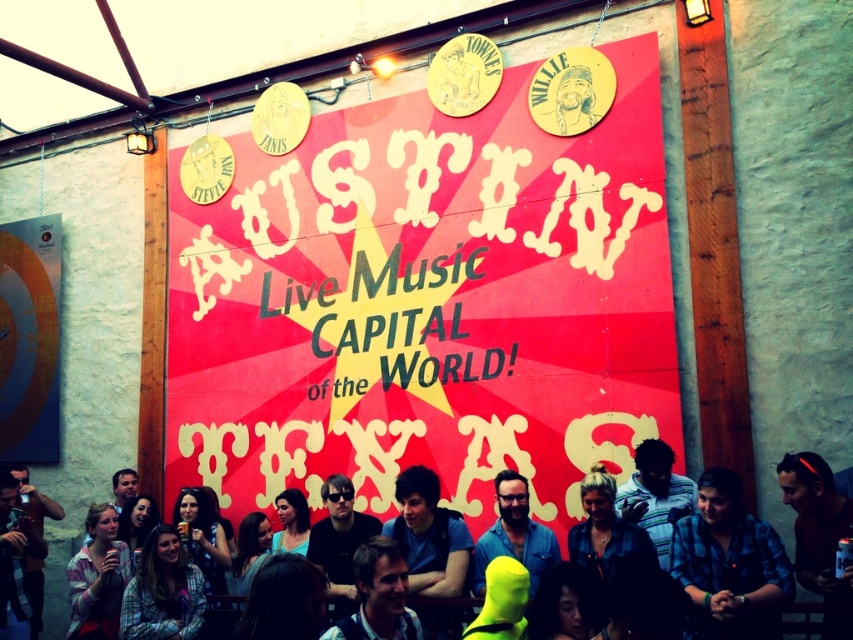
Is blue plaid shirt at lower right taller than matte black camera at lower left?

No, blue plaid shirt at lower right is not taller than matte black camera at lower left.

What do you see at coordinates (729, 563) in the screenshot? I see `blue plaid shirt at lower right` at bounding box center [729, 563].

Between point (727, 515) and point (24, 625), which one is positioned in front?

Point (727, 515) is more forward.

This screenshot has width=853, height=640. I want to click on blue plaid shirt at lower right, so click(x=729, y=563).

Does neon yellow wig at lower center appear on the left side of matte pink shirt at lower left?

No, neon yellow wig at lower center is not to the left of matte pink shirt at lower left.

Is point (473, 516) positioned in front of point (79, 628)?

No.

At what (x,y) coordinates should I click in order to perform the action: click on neon yellow wig at lower center. Please return your answer as a coordinate pair (x, y). Image resolution: width=853 pixels, height=640 pixels. Looking at the image, I should click on (62, 540).

In the scene shown: How far apart are red matte poster at center and plaid shirt at lower left?

A distance of 16.83 feet exists between red matte poster at center and plaid shirt at lower left.

Does point (281, 312) lie behind point (132, 604)?

Yes.

Identify the location of red matte poster at center. This screenshot has width=853, height=640. (427, 301).